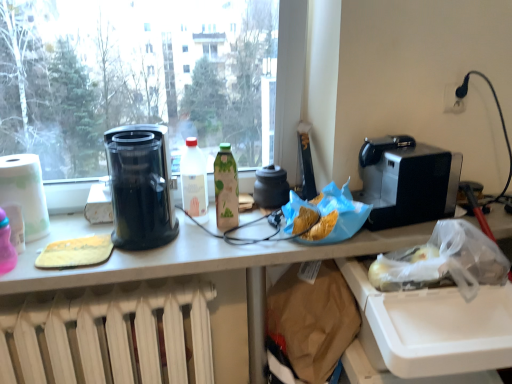
I want to click on empty space that is ontop of white radiator at lower center (from a real-world perspective), so click(x=120, y=289).